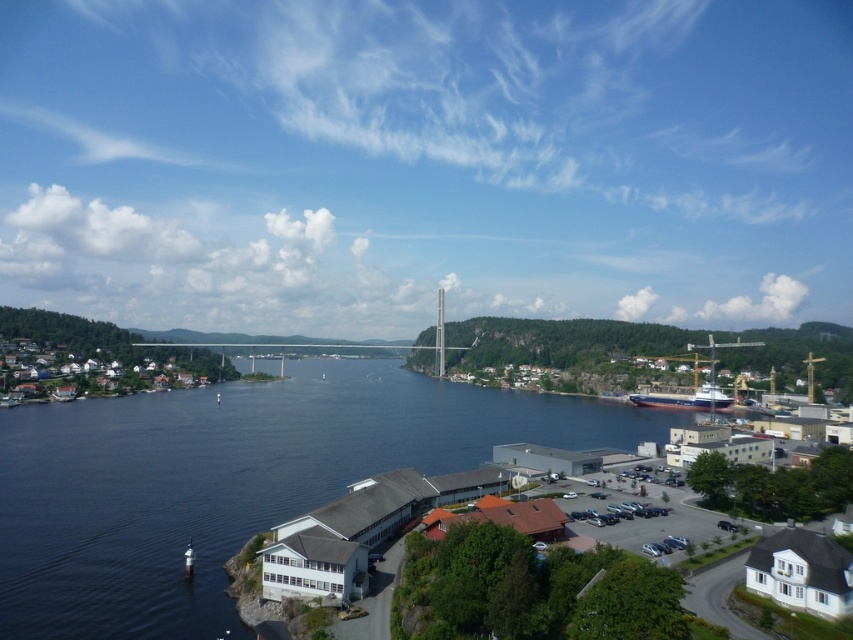
Who is taller, blue water at center or white wooden houses at left?

With more height is white wooden houses at left.

Image resolution: width=853 pixels, height=640 pixels. I want to click on blue water at center, so click(x=231, y=481).

Does point (45, 556) come farther from viewer compared to point (177, 376)?

No.

You are a GUI agent. You are given a task and a screenshot of the screen. Output one action in this format:
    pyautogui.click(x=<x>, y=<y>)
    Task: Click on the blue water at center
    Image resolution: width=853 pixels, height=640 pixels.
    Given the screenshot: What is the action you would take?
    pyautogui.click(x=231, y=481)

Which is below, blue water at center or blue metallic ship at lower right?

blue metallic ship at lower right is lower down.

Who is more distant from viewer, (289, 432) or (701, 400)?

Point (701, 400)

The image size is (853, 640). I want to click on blue water at center, so click(231, 481).

Who is more forward, (28,358) or (646,397)?

Point (28,358) is more forward.

Can you confirm if white wooden houses at left is smaller than blue metallic ship at lower right?

No, white wooden houses at left is not smaller than blue metallic ship at lower right.

Describe the element at coordinates (93, 358) in the screenshot. I see `white wooden houses at left` at that location.

Where is `white wooden houses at left`? Image resolution: width=853 pixels, height=640 pixels. white wooden houses at left is located at coordinates (93, 358).